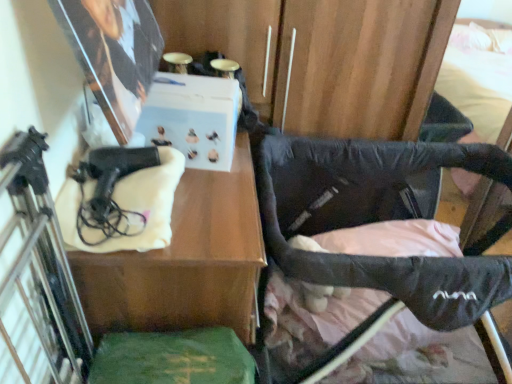
The image size is (512, 384). Find the location of `vacant area that is situated to the right of black matte gun at left`. vacant area that is situated to the right of black matte gun at left is located at coordinates (209, 209).